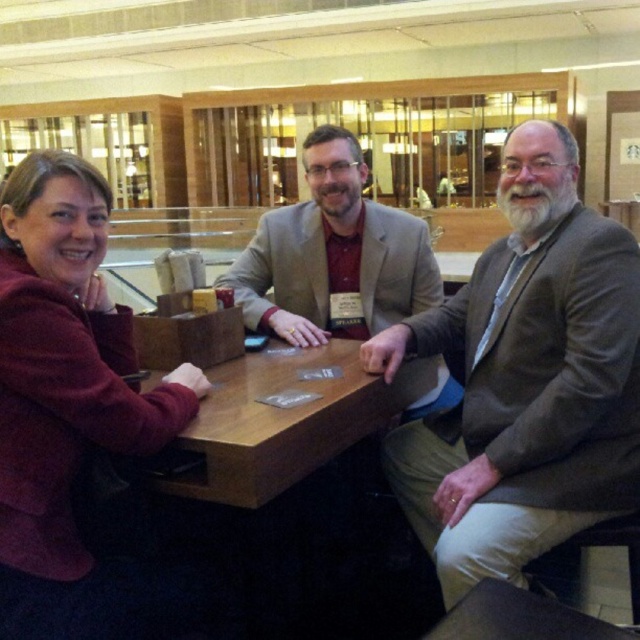
Looking at this image, which is more to the left, brown woolen sweater at right or brown wooden table at center?

brown wooden table at center is more to the left.

Is brown woolen sweater at right positioned at the back of brown wooden table at center?

Yes, brown woolen sweater at right is behind brown wooden table at center.

Which is behind, point (502, 276) or point (268, 476)?

Positioned behind is point (502, 276).

This screenshot has width=640, height=640. What are the coordinates of `brown woolen sweater at right` in the screenshot? It's located at (524, 380).

Which is more to the left, matte gray blazer at center or brown wooden table at center?

brown wooden table at center is more to the left.

Which is above, matte gray blazer at center or brown wooden table at center?

Positioned higher is matte gray blazer at center.

Is point (358, 208) closer to viewer compared to point (168, 474)?

No.

The height and width of the screenshot is (640, 640). What are the coordinates of `matte gray blazer at center` in the screenshot? It's located at (333, 253).

Is brown woolen sweater at right wider than maroon fleece jacket at left?

Correct, the width of brown woolen sweater at right exceeds that of maroon fleece jacket at left.

Who is shorter, brown woolen sweater at right or maroon fleece jacket at left?

maroon fleece jacket at left is shorter.

Identify the location of brown woolen sweater at right. The width and height of the screenshot is (640, 640). (524, 380).